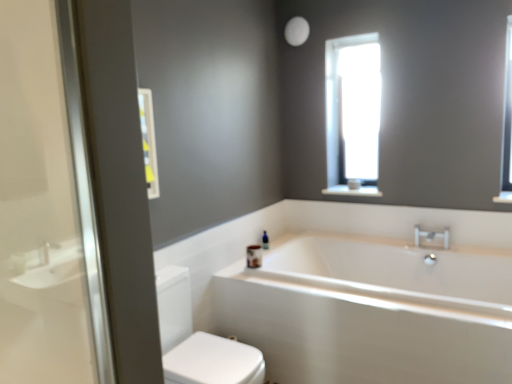
You are a GUI agent. You are given a task and a screenshot of the screen. Output one action in this format:
    pyautogui.click(x=<x>, y=<y>)
    Task: Click on the unoccupied region to the right of blue glass bottle at upper center
    
    Given the screenshot: What is the action you would take?
    pyautogui.click(x=283, y=250)